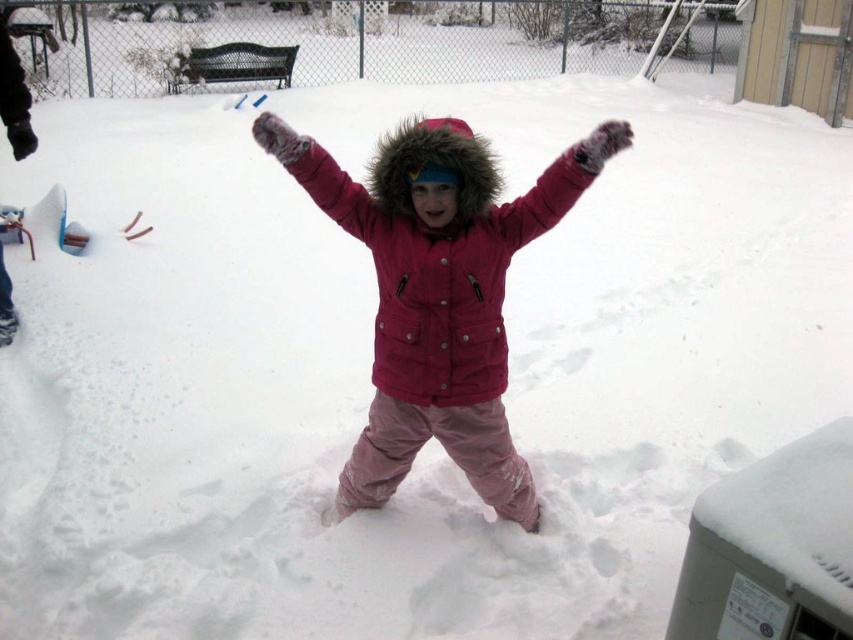
Question: Can you confirm if matte pink snowsuit at center is thinner than fuzzy pink arm at center?

Choices:
 (A) yes
 (B) no

Answer: (B)

Question: Which object is the farthest from the fuzzy pink glove at center?

Choices:
 (A) matte pink snowsuit at center
 (B) fuzzy pink arm at center

Answer: (B)

Question: Considering the real-world distances, which object is closest to the fuzzy pink glove at center?

Choices:
 (A) fuzzy pink arm at center
 (B) matte pink snowsuit at center

Answer: (B)

Question: Is matte pink snowsuit at center bigger than fuzzy pink glove at center?

Choices:
 (A) yes
 (B) no

Answer: (A)

Question: Among these points, which one is nearest to the camera?

Choices:
 (A) (508, 225)
 (B) (289, 134)

Answer: (B)

Question: Where is matte pink snowsuit at center located in relation to fuzzy pink arm at center in the image?

Choices:
 (A) left
 (B) right

Answer: (B)